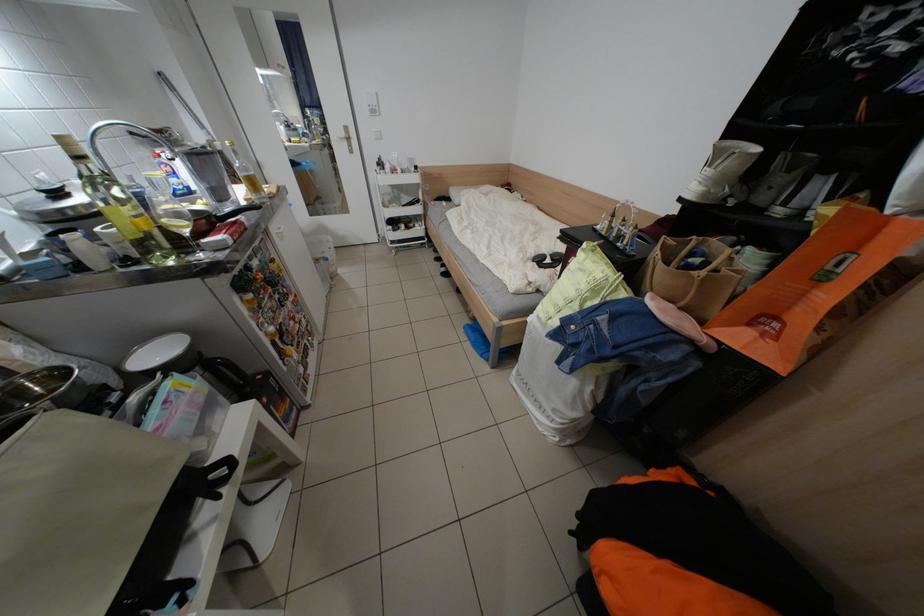
Locate an element on the screen. The width and height of the screenshot is (924, 616). white bowl is located at coordinates (162, 355).